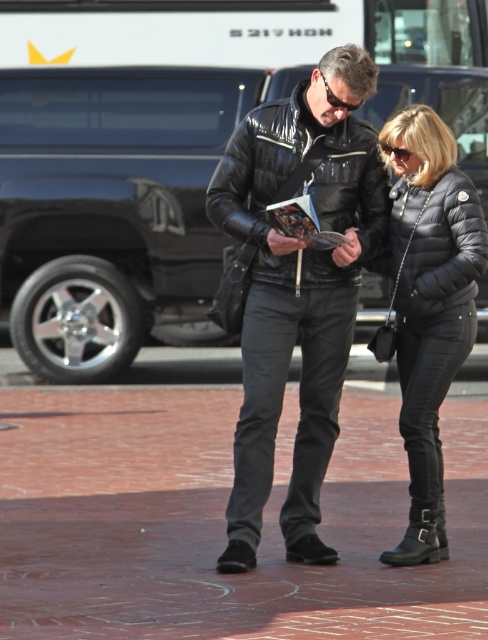
Which is in front, point (218, 582) or point (248, 132)?

Point (218, 582)

Does brick pavement at center come in front of glossy black jacket at center?

Yes, brick pavement at center is in front of glossy black jacket at center.

Does point (0, 532) come behind point (378, 218)?

That is True.

You are a GUI agent. You are given a task and a screenshot of the screen. Output one action in this format:
    pyautogui.click(x=<x>, y=<y>)
    Task: Click on the brick pavement at center
    The width and height of the screenshot is (488, 640).
    Given the screenshot: What is the action you would take?
    (221, 522)

Does brick pavement at center have a larger size compared to black quilted jacket at center?

Incorrect, brick pavement at center is not larger than black quilted jacket at center.

Who is more distant from viewer, (72, 637) or (432, 524)?

Point (432, 524)

Find the location of a particular element. brick pavement at center is located at coordinates (221, 522).

Does black leather jacket at center have a smaller size compared to glossy black jacket at center?

No, black leather jacket at center is not smaller than glossy black jacket at center.

What do you see at coordinates (298, 285) in the screenshot? The width and height of the screenshot is (488, 640). I see `black leather jacket at center` at bounding box center [298, 285].

This screenshot has height=640, width=488. I want to click on black leather jacket at center, so click(298, 285).

Locate an element on the screen. The height and width of the screenshot is (640, 488). black leather jacket at center is located at coordinates (298, 285).